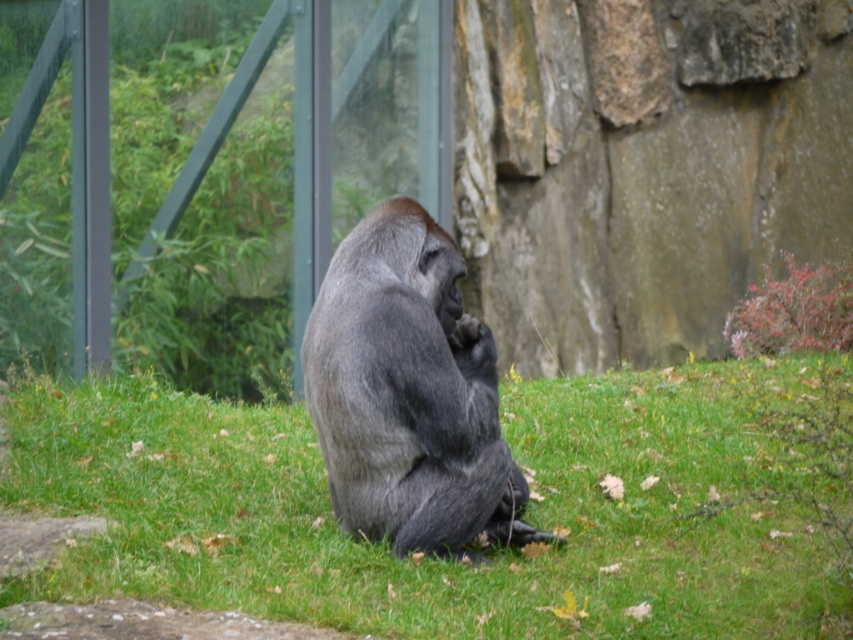
Question: Does green soft grass at center appear on the right side of gray fur gorilla at center?

Choices:
 (A) yes
 (B) no

Answer: (B)

Question: Which of the following is the closest to the observer?

Choices:
 (A) gray fur gorilla at center
 (B) green soft grass at center

Answer: (B)

Question: Is green soft grass at center to the left of gray fur gorilla at center from the viewer's perspective?

Choices:
 (A) yes
 (B) no

Answer: (A)

Question: Is green soft grass at center to the left of gray fur gorilla at center from the viewer's perspective?

Choices:
 (A) no
 (B) yes

Answer: (B)

Question: Which point is closer to the camera?

Choices:
 (A) gray fur gorilla at center
 (B) green soft grass at center

Answer: (B)

Question: Which object is farther from the camera taking this photo?

Choices:
 (A) gray fur gorilla at center
 (B) green soft grass at center

Answer: (A)